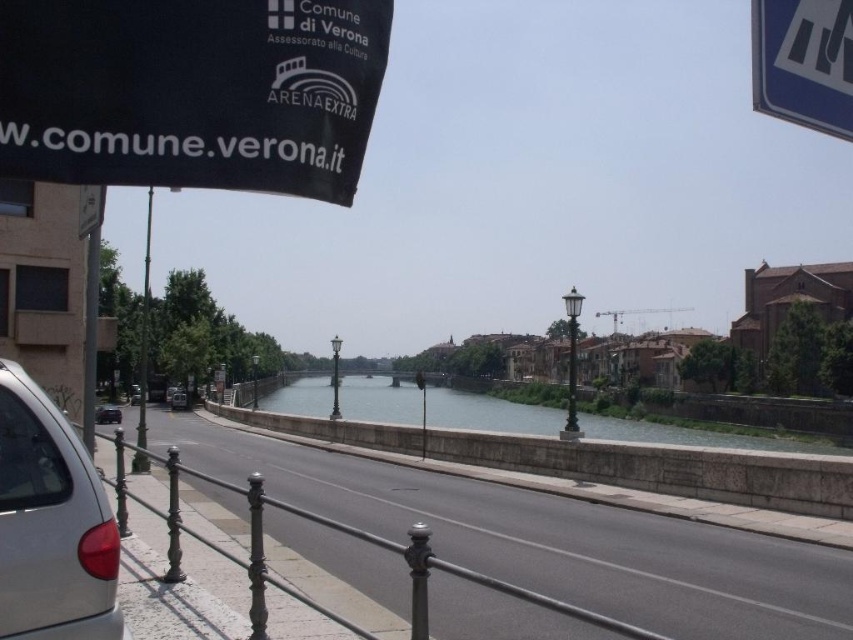
Does green metallic pole at left have a lesser width compared to black metal pole at center?

Incorrect, green metallic pole at left's width is not less than black metal pole at center's.

Does green metallic pole at left have a larger size compared to black metal pole at center?

Indeed, green metallic pole at left has a larger size compared to black metal pole at center.

Who is more distant from viewer, (x=148, y=300) or (x=569, y=428)?

Positioned behind is point (x=148, y=300).

This screenshot has height=640, width=853. I want to click on green metallic pole at left, so click(x=144, y=330).

Can you confirm if blue plastic sign at upper right is bigger than green metallic pole at left?

No, blue plastic sign at upper right is not bigger than green metallic pole at left.

Locate an element on the screen. The height and width of the screenshot is (640, 853). blue plastic sign at upper right is located at coordinates (804, 61).

Does black fabric sign at upper left have a smaller size compared to clear water at center?

Indeed, black fabric sign at upper left has a smaller size compared to clear water at center.

Does black fabric sign at upper left have a greater width compared to clear water at center?

Answer: No.

The height and width of the screenshot is (640, 853). I want to click on black fabric sign at upper left, so click(190, 92).

Find the location of a particular element. black fabric sign at upper left is located at coordinates (190, 92).